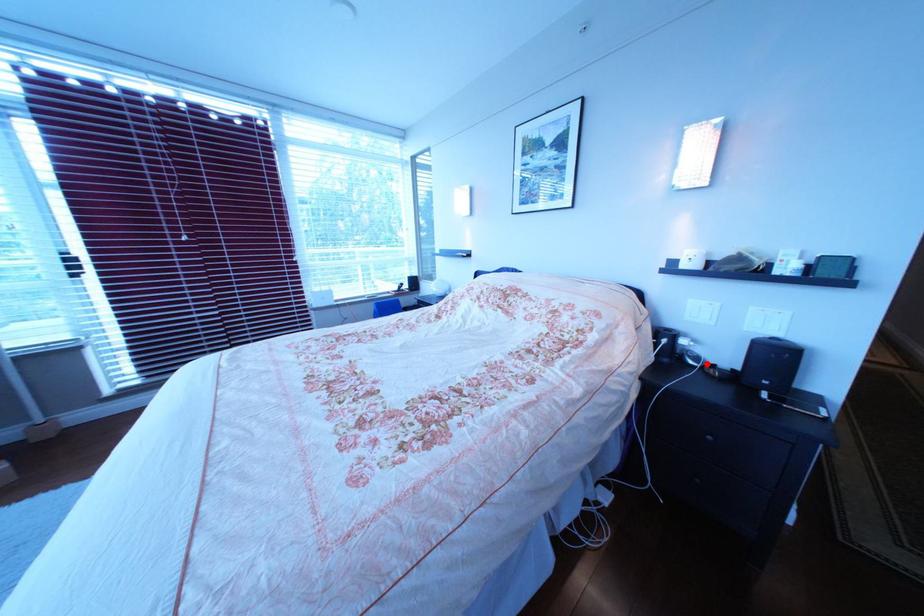
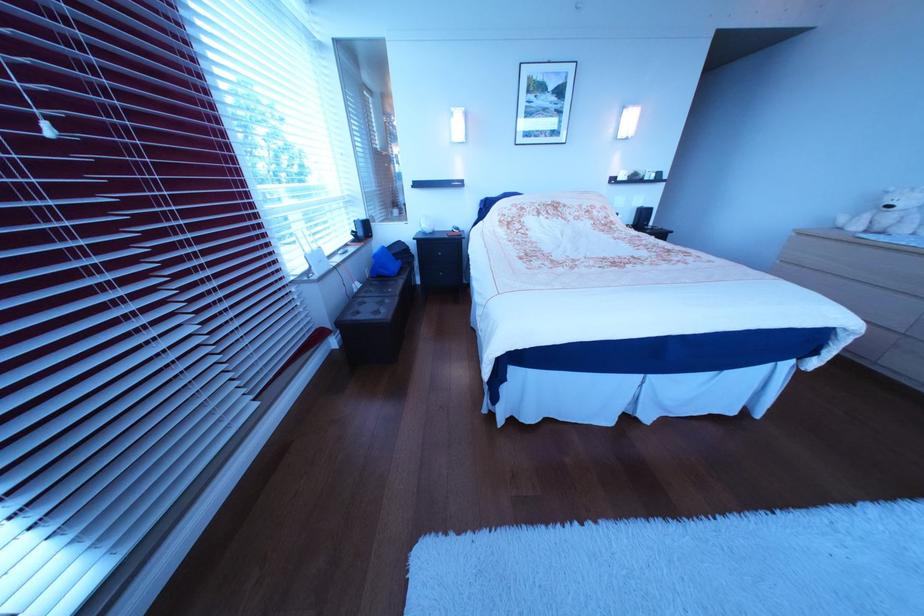
Question: I am providing you with two images of the same scene from different viewpoints. A red point is marked on the first image. At the location where the point appears in image 1, is it still visible in image 2?

Choices:
 (A) Yes
 (B) No

Answer: (B)